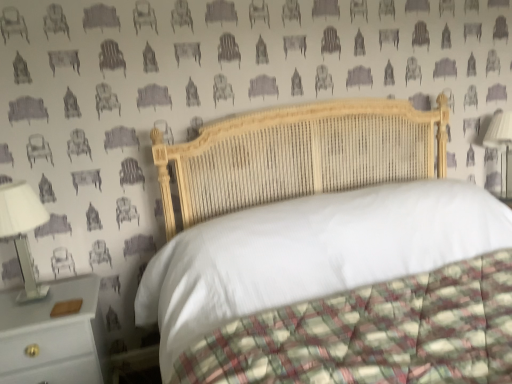
Question: From a real-world perspective, is white glossy bedside lamp at left, which is the 1th bedside lamp in left-to-right order, positioned above or below white wood nightstand at lower left?

Choices:
 (A) below
 (B) above

Answer: (B)

Question: Is white glossy bedside lamp at left, arranged as the first bedside lamp when viewed from the front, taller or shorter than white wood nightstand at lower left?

Choices:
 (A) short
 (B) tall

Answer: (A)

Question: Estimate the real-world distances between objects in this image. Which object is farther from the white glossy bedside lamp at left, arranged as the first bedside lamp when viewed from the front?

Choices:
 (A) white wood nightstand at lower left
 (B) wooden bed at center
 (C) white fabric lampshade at right, marked as the first bedside lamp in a top-to-bottom arrangement

Answer: (C)

Question: Estimate the real-world distances between objects in this image. Which object is closer to the white wood nightstand at lower left?

Choices:
 (A) white fabric lampshade at right, which is the first bedside lamp in right-to-left order
 (B) wooden bed at center
 (C) white glossy bedside lamp at left, which appears as the 2th bedside lamp when viewed from the right

Answer: (C)